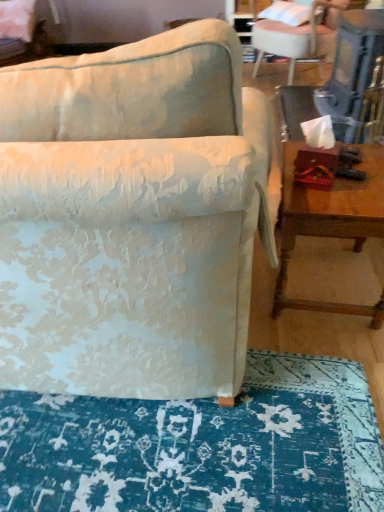
You are a GUI agent. You are given a task and a screenshot of the screen. Output one action in this format:
    pyautogui.click(x=<x>, y=<y>)
    Task: Click on the free point above wooden table at right (from a real-world perspective)
    The height and width of the screenshot is (512, 384).
    Given the screenshot: What is the action you would take?
    pyautogui.click(x=354, y=185)